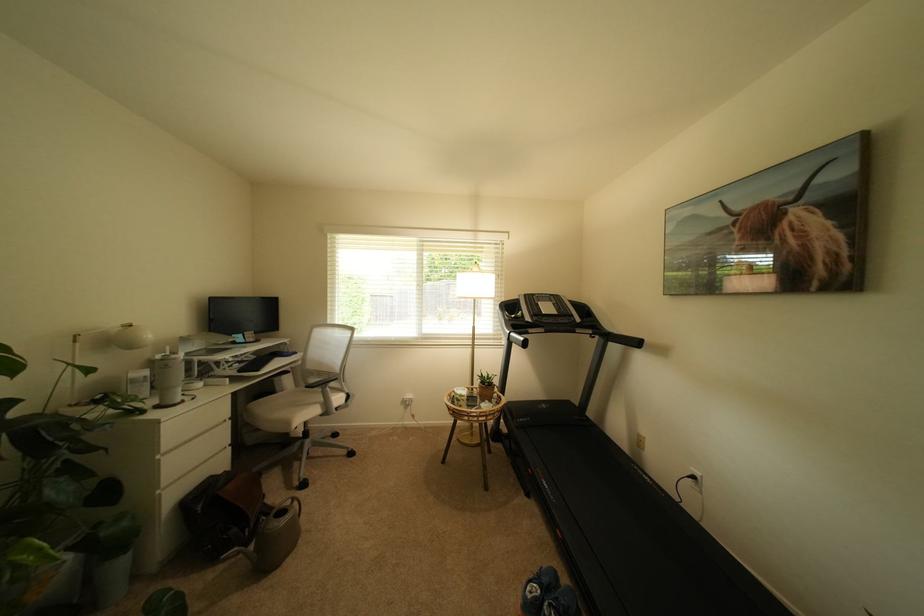
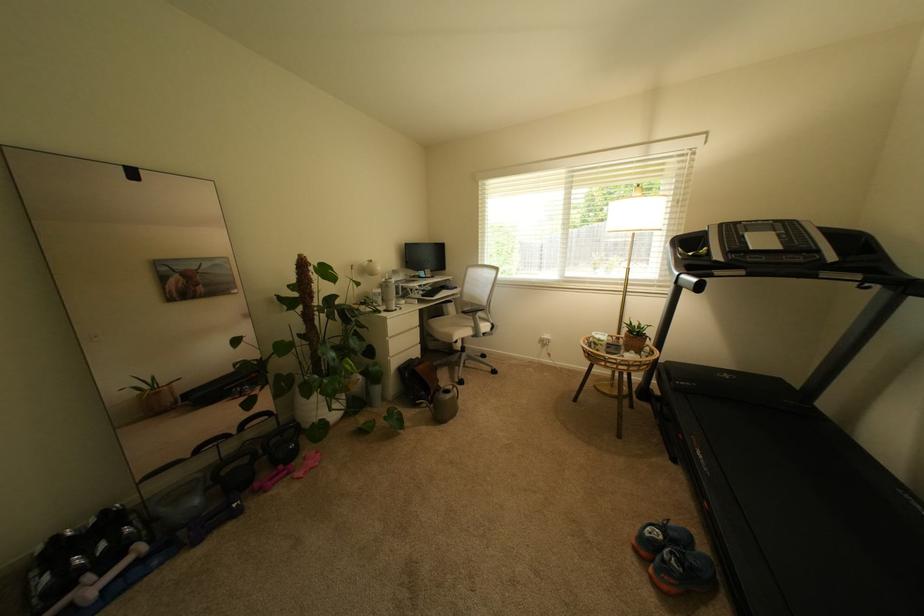
Where in the second image is the point corresponding to point 297,424 from the first image?

(459, 338)